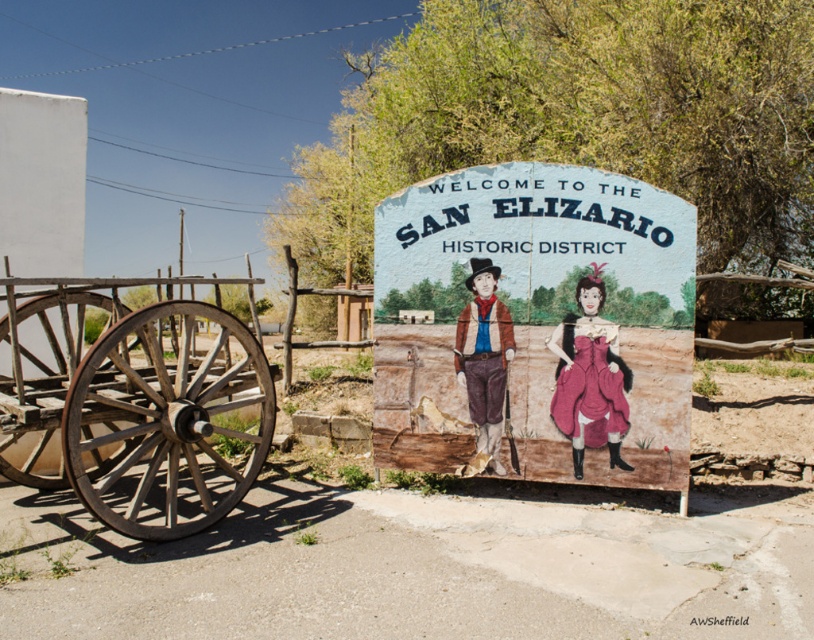
You are a tour guide leading a group through the San Elizario Historic District. You need to explain the significance of the two main objects in the scene. Which object is wider, the rustic wooden sign at center or the wooden wagon wheel at left?

The rustic wooden sign at center is wider than the wooden wagon wheel at left according to the description.

You are standing at the entrance of the San Elizario Historic District and see two points marked on the ground. The first point is at coordinates point (x=641, y=234) and the second is at point (x=154, y=512). If you face the direction the two historical figures are looking, which point would be further back from you?

Point (x=641, y=234) is behind point (x=154, y=512), so if you face the direction the historical figures are looking, the point further back from you would be point (x=641, y=234).

You are a visitor standing in front of the rustic wooden sign at center and the wooden wagon wheel at left. Which object is taller?

The rustic wooden sign at center is taller than the wooden wagon wheel at left.